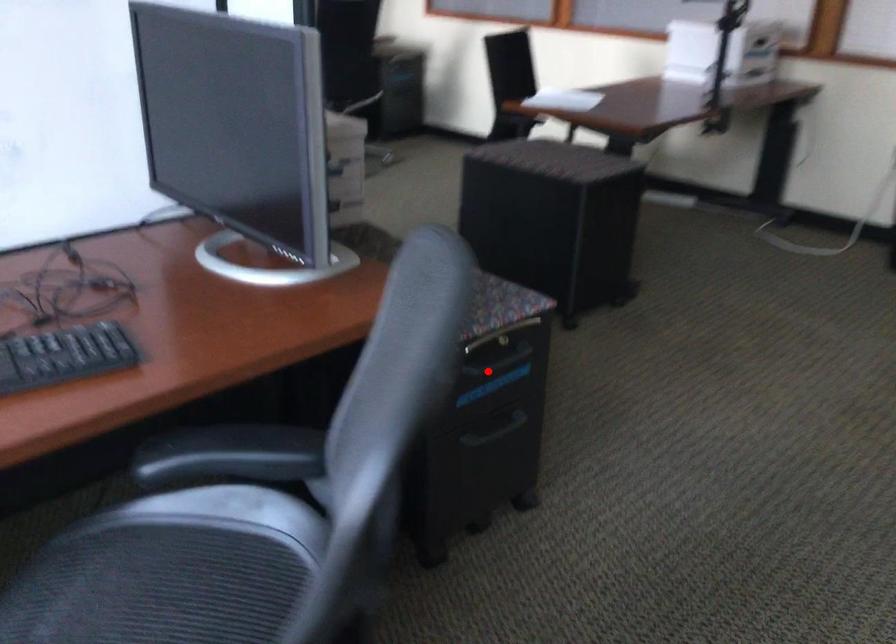
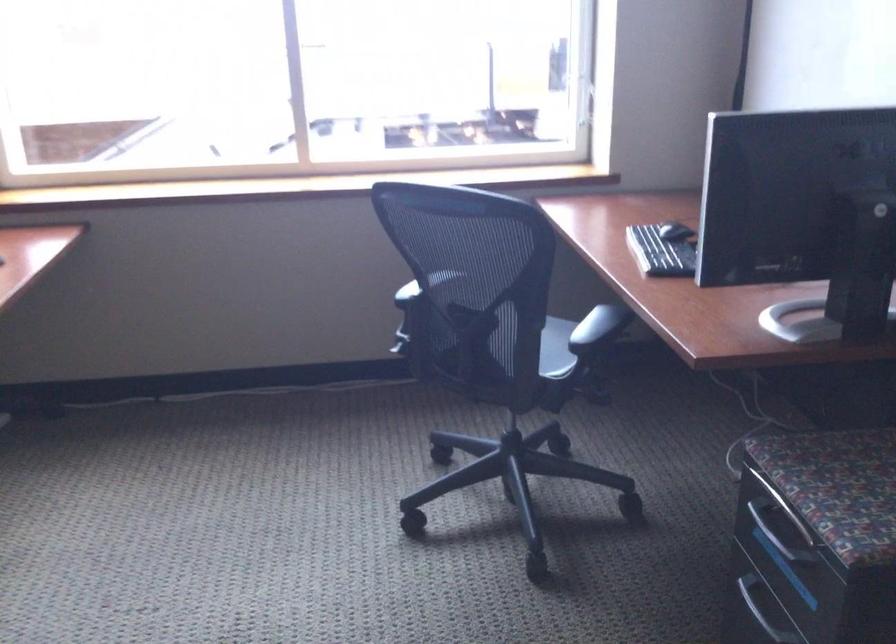
Question: I am providing you with two images of the same scene from different viewpoints. A red point is shown in image1. For the corresponding object point in image2, is it positioned nearer or farther from the camera?

Choices:
 (A) Nearer
 (B) Farther

Answer: (A)